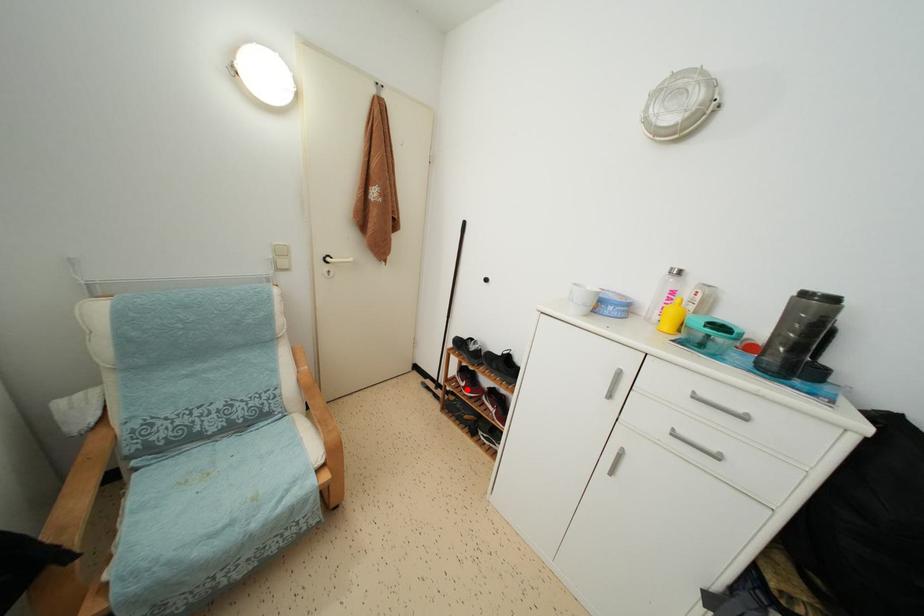
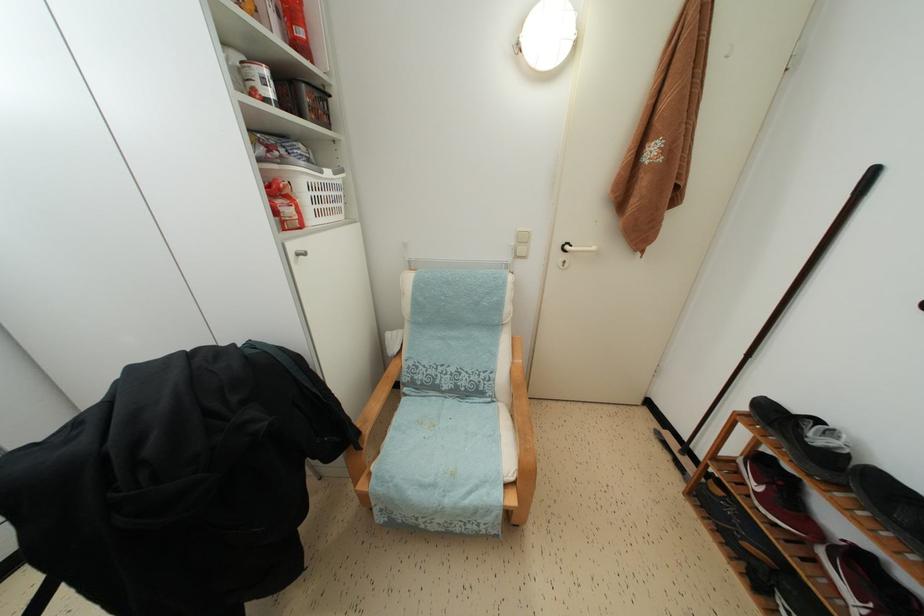
Where in the second image is the point corresponding to the highlighted location from the first image?

(760, 493)